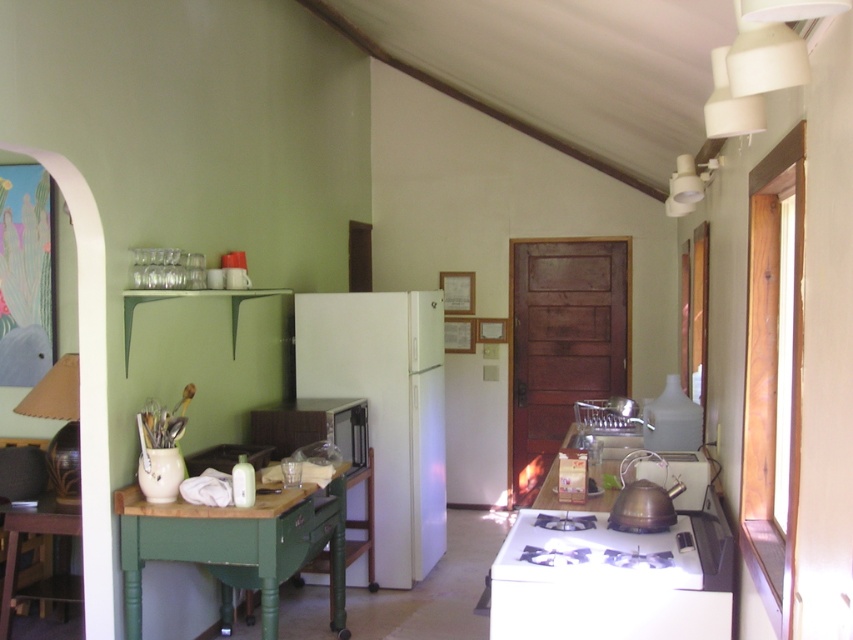
Question: Is white matte refrigerator at center thinner than white glossy stove at lower center?

Choices:
 (A) yes
 (B) no

Answer: (B)

Question: Which point is farther to the camera?

Choices:
 (A) green wood table at lower left
 (B) white glossy stove at lower center
 (C) white matte refrigerator at center
 (D) green matte drawer at lower center

Answer: (C)

Question: Is white matte refrigerator at center bigger than shiny brass kettle at center?

Choices:
 (A) yes
 (B) no

Answer: (A)

Question: Estimate the real-world distances between objects in this image. Which object is closer to the white matte refrigerator at center?

Choices:
 (A) white glossy stove at lower center
 (B) green painted wood table at left
 (C) green wood table at lower left
 (D) shiny brass kettle at center

Answer: (B)

Question: Is white matte refrigerator at center smaller than green matte drawer at lower center?

Choices:
 (A) no
 (B) yes

Answer: (A)

Question: Which point is farther from the camera taking this photo?

Choices:
 (A) (358, 440)
 (B) (9, 518)
 (C) (247, 540)
 (D) (583, 568)

Answer: (A)